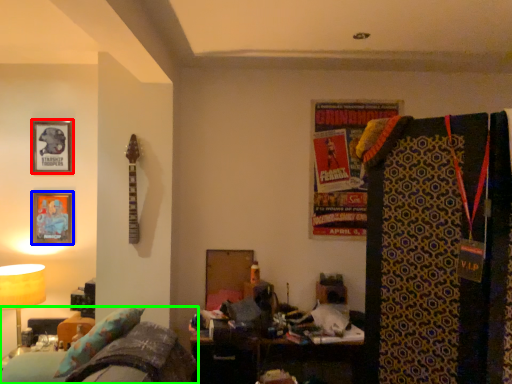
Question: Which object is positioned closest to picture frame (highlighted by a red box)? Select from picture frame (highlighted by a blue box) and furniture (highlighted by a green box).

Choices:
 (A) picture frame
 (B) furniture

Answer: (A)